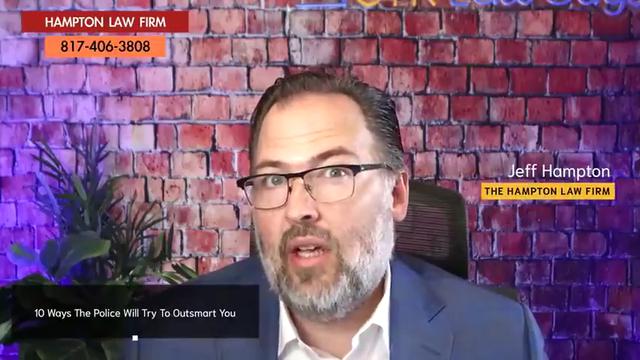
At what (x,y) coordinates should I click in order to perform the action: click on green plant. Please return your answer as a coordinate pair (x, y). Image resolution: width=640 pixels, height=360 pixels. Looking at the image, I should click on (79, 246).